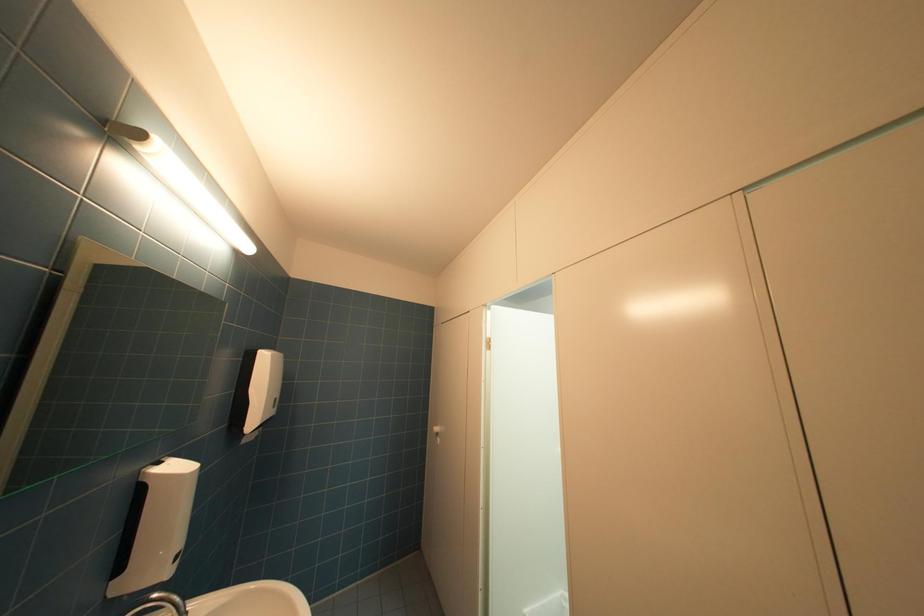
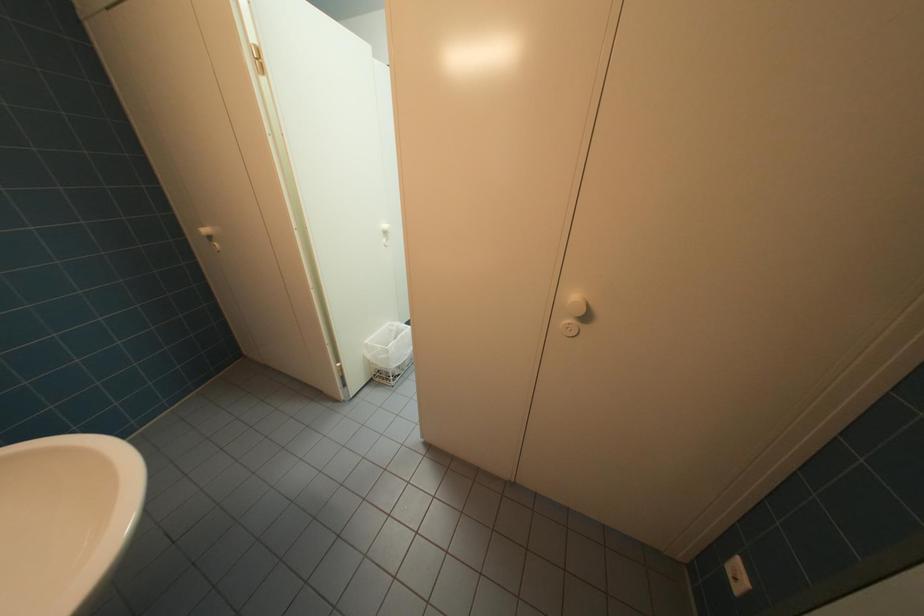
Based on the continuous images, in which direction is the camera rotating?

The camera's rotation is toward right-down.